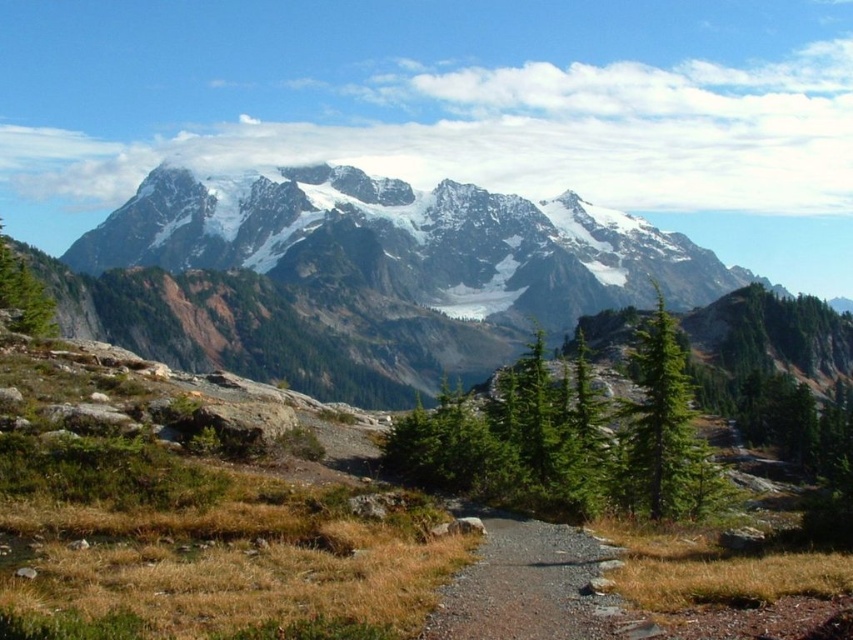
Looking at this image, you are planning a hiking trip and see the snowy granite mountain range at center and the gravel path at center in the image. Which of these two is taller?

The snowy granite mountain range at center is much taller than the gravel path at center.